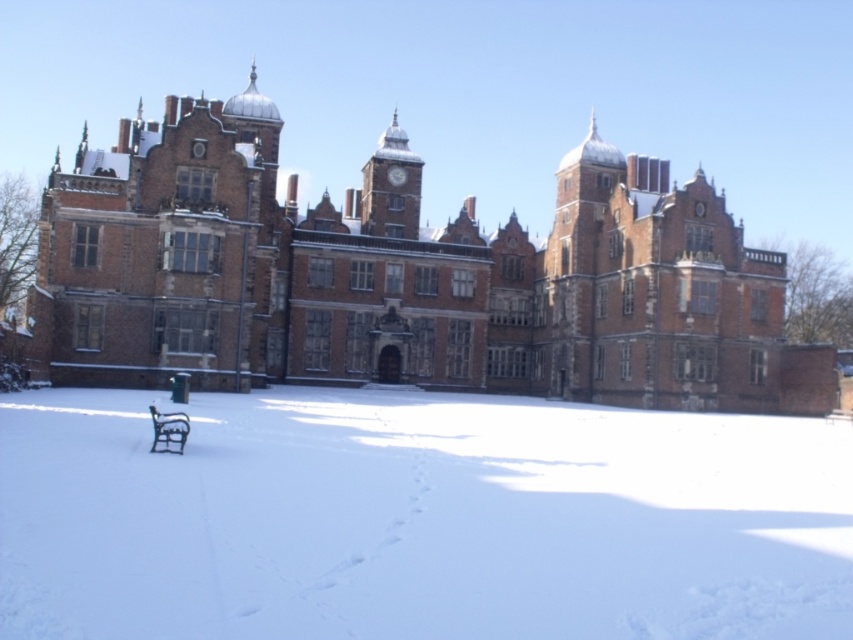
You are standing in front of the historic building and want to walk from point A to point B. If point A is at point (219,131) and point B is at point (155,436), which direction should you move to get closer to point B?

You should move towards the right and slightly forward because point (219,131) is further away from you than point (155,436), so moving right and forward will bring you closer to point B.

You are standing in front of the historic building and want to sit down. There is a black wrought iron bench at lower left and white powdery snow at center. Which one is closer to you where you can sit immediately?

The white powdery snow at center is closer to the viewer than the black wrought iron bench at lower left, so you can sit immediately on the white powdery snow at center.

You are planning to take a photo of the brown brick castle at center and the black wrought iron bench at lower left. Since you want both objects to appear equally prominent in the photo, which one should you zoom in on more?

The brown brick castle at center is larger in size than the black wrought iron bench at lower left, so you should zoom in more on the black wrought iron bench at lower left to make both appear equally prominent in the photo.